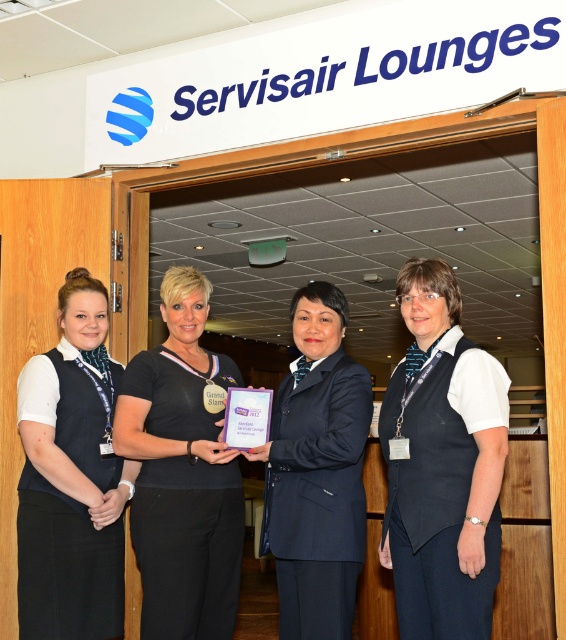
Is point (220, 532) less distant than point (28, 481)?

Yes, point (220, 532) is in front of point (28, 481).

Is the position of black fabric shirt at center more distant than that of matte black vest at left?

No, black fabric shirt at center is closer to the viewer.

Does point (144, 362) come closer to viewer compared to point (113, 579)?

That is True.

You are a GUI agent. You are given a task and a screenshot of the screen. Output one action in this format:
    pyautogui.click(x=<x>, y=<y>)
    Task: Click on the black fabric shirt at center
    
    Given the screenshot: What is the action you would take?
    pyautogui.click(x=182, y=472)

Who is more distant from viewer, (443, 316) or (57, 628)?

The point (57, 628) is more distant.

Looking at this image, how much distance is there between white fabric vest at center and matte black vest at left?

white fabric vest at center and matte black vest at left are 1.25 meters apart.

Between point (380, 420) and point (109, 396), which one is positioned in front?

Positioned in front is point (380, 420).

Locate an element on the screen. The width and height of the screenshot is (566, 640). white fabric vest at center is located at coordinates (443, 467).

This screenshot has width=566, height=640. Describe the element at coordinates (443, 467) in the screenshot. I see `white fabric vest at center` at that location.

Based on the photo, does white fabric vest at center appear on the left side of black fabric shirt at center?

Incorrect, white fabric vest at center is not on the left side of black fabric shirt at center.

Where is `white fabric vest at center`? Image resolution: width=566 pixels, height=640 pixels. white fabric vest at center is located at coordinates (443, 467).